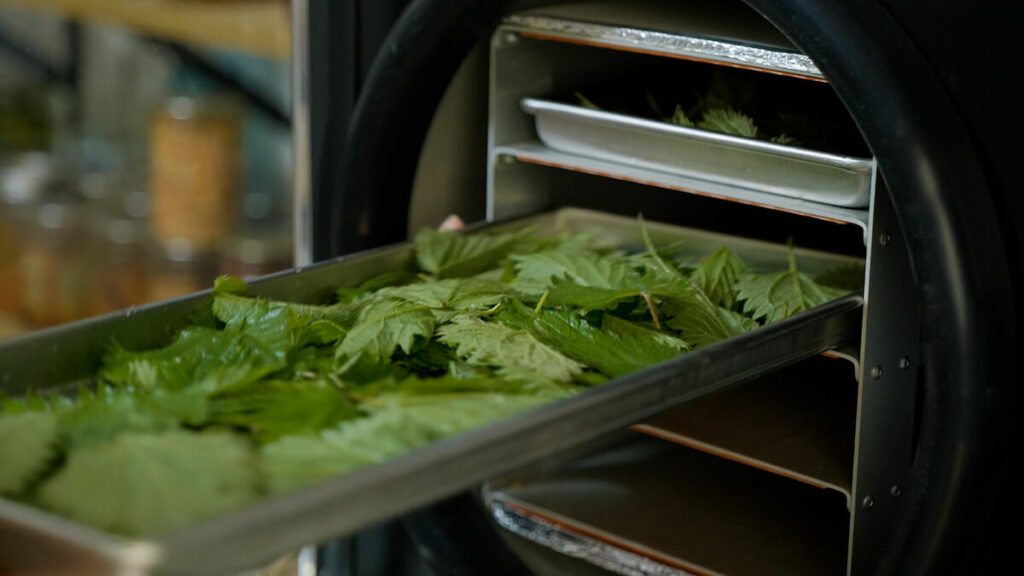
This screenshot has height=576, width=1024. Identify the location of jars. (191, 164), (44, 276), (83, 272), (176, 276), (256, 256), (100, 183), (142, 195), (265, 211).